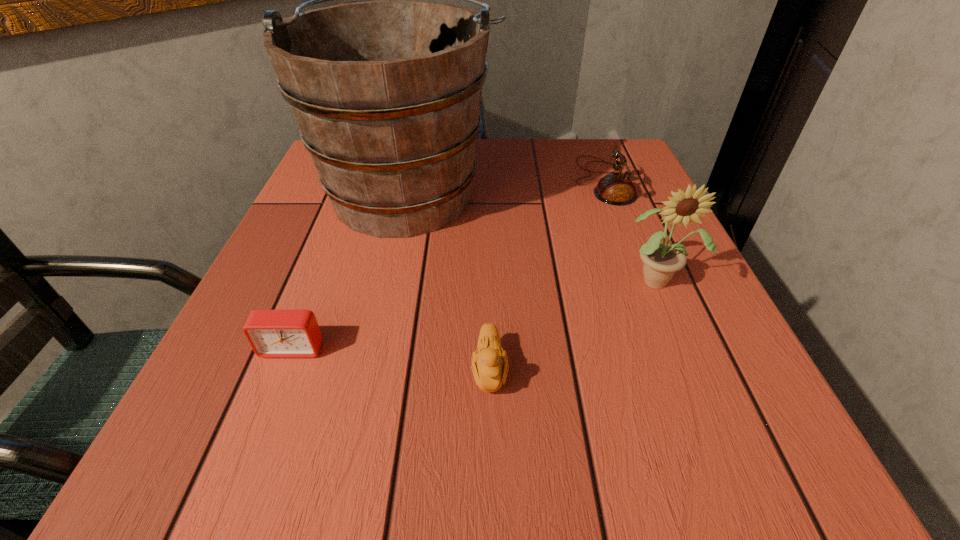
You are a GUI agent. You are given a task and a screenshot of the screen. Output one action in this format:
    pyautogui.click(x=<x>, y=<y>)
    Task: Click on the vacant region located 0.090m on the face of the duckling
    
    Given the screenshot: What is the action you would take?
    pyautogui.click(x=492, y=470)

Locate an element on the screen. The width and height of the screenshot is (960, 540). blank area located on the front-facing side of the alarm clock is located at coordinates (263, 424).

Find the location of `bucket that is at the far edge`. bucket that is at the far edge is located at coordinates (386, 94).

Find the location of a particular element. telephone that is at the far edge is located at coordinates (616, 188).

Identify the location of bucket present at the left edge. This screenshot has height=540, width=960. (386, 94).

The image size is (960, 540). I want to click on alarm clock situated at the left edge, so click(271, 333).

Find the location of `sunflower that is at the right edge`. sunflower that is at the right edge is located at coordinates (661, 260).

You are a GUI agent. You are given a task and a screenshot of the screen. Output one action in this format:
    pyautogui.click(x=<x>, y=<y>)
    Task: Click on the telephone that is positioned at the right edge
    Image resolution: width=960 pixels, height=540 pixels.
    Given the screenshot: What is the action you would take?
    pyautogui.click(x=616, y=188)

Image resolution: width=960 pixels, height=540 pixels. What are the coordinates of `object present at the far left corner` in the screenshot? It's located at (386, 94).

You are a GUI agent. You are given a task and a screenshot of the screen. Output one action in this format:
    pyautogui.click(x=<x>, y=<y>)
    Task: Click on the object positioned at the far right corner
    
    Given the screenshot: What is the action you would take?
    pyautogui.click(x=616, y=188)